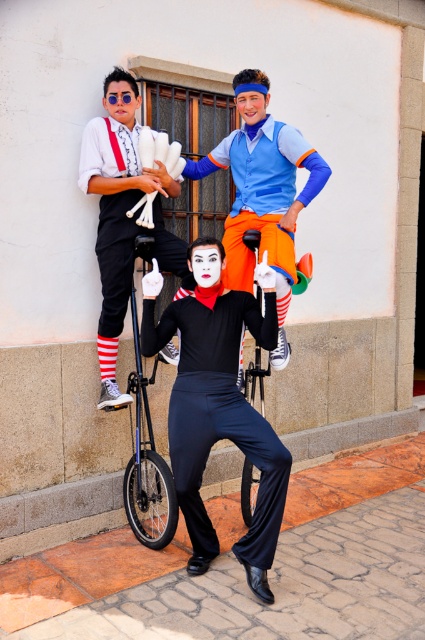
Question: Which of these objects is positioned closest to the black satin pants at center?

Choices:
 (A) matte white gloves at upper left
 (B) shiny black monocycle at center

Answer: (B)

Question: Estimate the real-world distances between objects in this image. Which object is farther from the black satin pants at center?

Choices:
 (A) matte white gloves at upper left
 (B) shiny black monocycle at center

Answer: (A)

Question: Among these objects, which one is farthest from the camera?

Choices:
 (A) black satin pants at center
 (B) shiny black monocycle at center
 (C) matte white gloves at upper left

Answer: (C)

Question: Can you confirm if black satin pants at center is wider than shiny black monocycle at center?

Choices:
 (A) yes
 (B) no

Answer: (A)

Question: Considering the relative positions of matte white gloves at upper left and shiny black monocycle at center in the image provided, where is matte white gloves at upper left located with respect to shiny black monocycle at center?

Choices:
 (A) right
 (B) left

Answer: (B)

Question: Is black satin pants at center wider than matte white gloves at upper left?

Choices:
 (A) yes
 (B) no

Answer: (A)